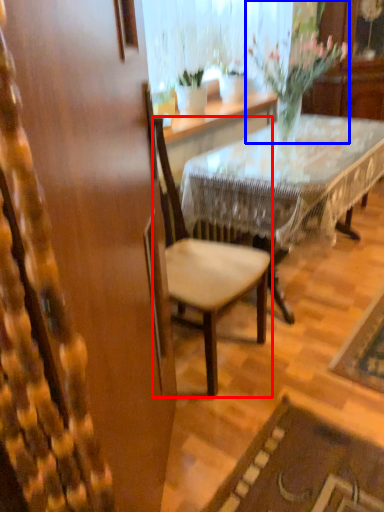
Question: Which object is further to the camera taking this photo, chair (highlighted by a red box) or houseplant (highlighted by a blue box)?

Choices:
 (A) chair
 (B) houseplant

Answer: (B)